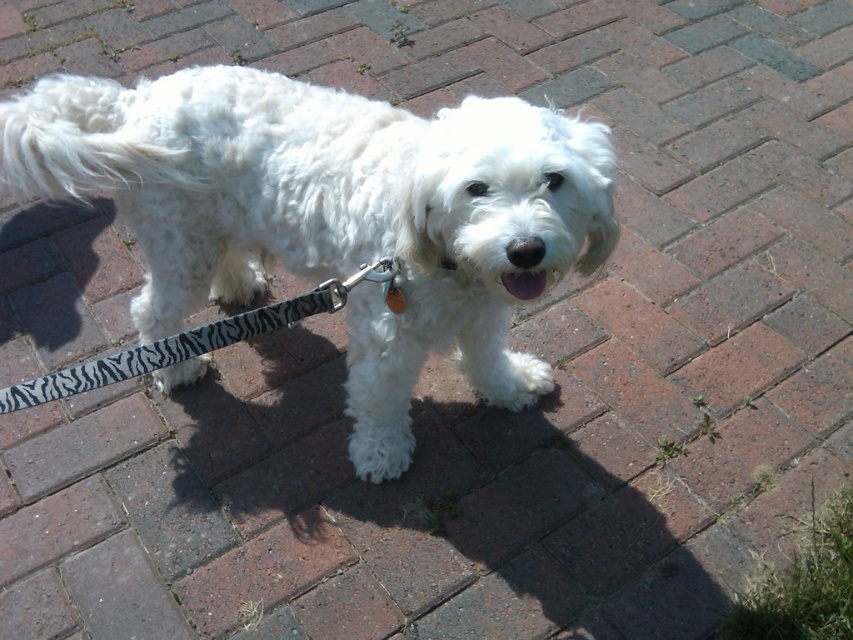
Where is the white fluffy dog at center located in the image?

The white fluffy dog at center is located at point [332,214].